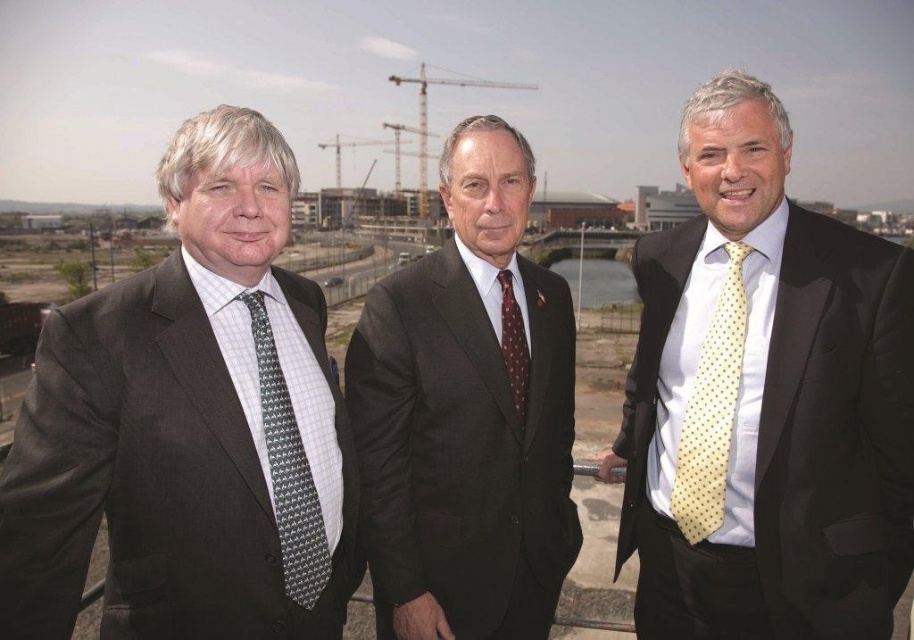
Between point (859, 436) and point (507, 280), which one is positioned in front?

Point (859, 436) is more forward.

Is yellow dotted tie at center shorter than maroon dotted tie at center?

In fact, yellow dotted tie at center may be taller than maroon dotted tie at center.

Which is in front, point (745, 516) or point (511, 372)?

Point (745, 516) is more forward.

This screenshot has width=914, height=640. Identify the location of yellow dotted tie at center. (764, 401).

Does point (229, 387) come in front of point (721, 352)?

Yes, it is.

Who is more distant from viewer, (317, 336) or (689, 438)?

Point (317, 336)

Find the location of a particular element. dark gray suit at left is located at coordinates (187, 426).

Does dark brown suit at center appear over yellow dotted tie at right?

Incorrect, dark brown suit at center is not positioned above yellow dotted tie at right.

Does dark brown suit at center have a larger size compared to yellow dotted tie at right?

Yes, dark brown suit at center is bigger than yellow dotted tie at right.

Does point (459, 220) lie behind point (730, 380)?

Yes, point (459, 220) is behind point (730, 380).

Image resolution: width=914 pixels, height=640 pixels. What are the coordinates of `dark brown suit at center` in the screenshot? It's located at (466, 417).